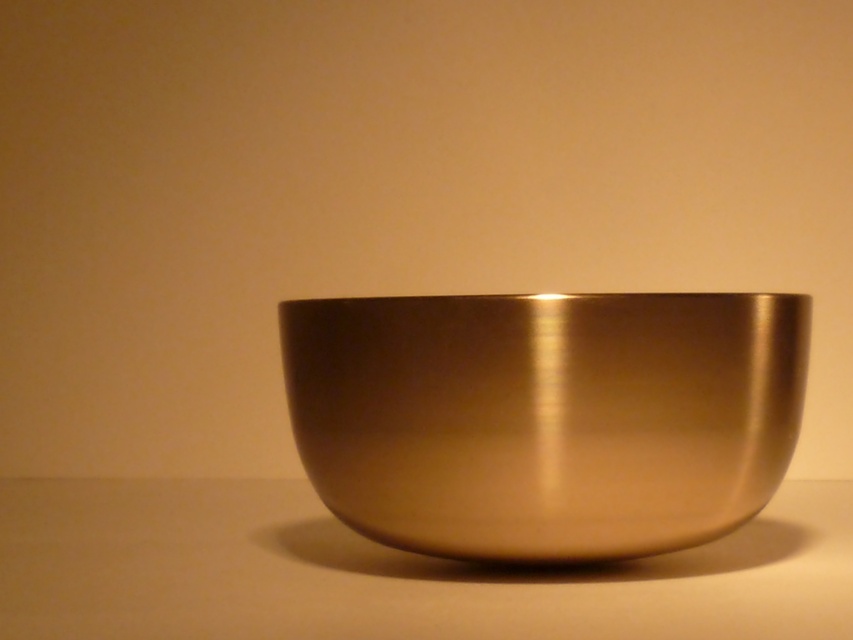
You are setting up a display and need to arrange the gold metallic bowl at center and the metallic gold bowl at center. According to the image, which one is positioned higher?

The gold metallic bowl at center is positioned higher than the metallic gold bowl at center.

You are holding a ruler and want to measure the distance between yourself and the gold metallic bowl at center. If the ruler is 12 inches long, can you fully extend it to measure the distance?

The gold metallic bowl at center and viewer are 19.53 inches apart from each other, so the ruler that is 12 inches long cannot fully extend to measure the distance. You need a longer ruler.

You are holding a camera and want to take a photo of the bowl. The bowl is located at point (x=416, y=321). If you are standing 20.24 inches away from the bowl, is the camera positioned close enough to capture the bowl in focus?

The point (x=416, y=321) and camera are 20.24 inches apart from each other. Since the camera is positioned at that exact distance, it should be close enough to capture the bowl in focus as long as the focus is properly adjusted.